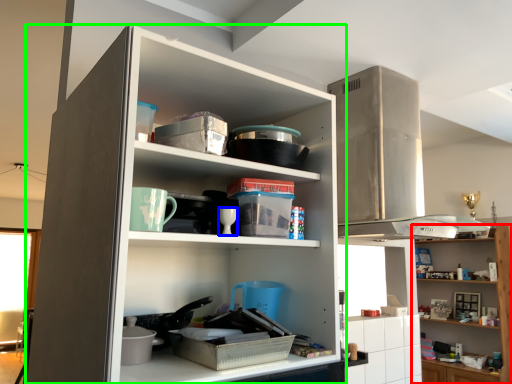
Question: Which is nearer to the shelf (highlighted by a red box)? tableware (highlighted by a blue box) or cupboard (highlighted by a green box).

Choices:
 (A) tableware
 (B) cupboard

Answer: (B)